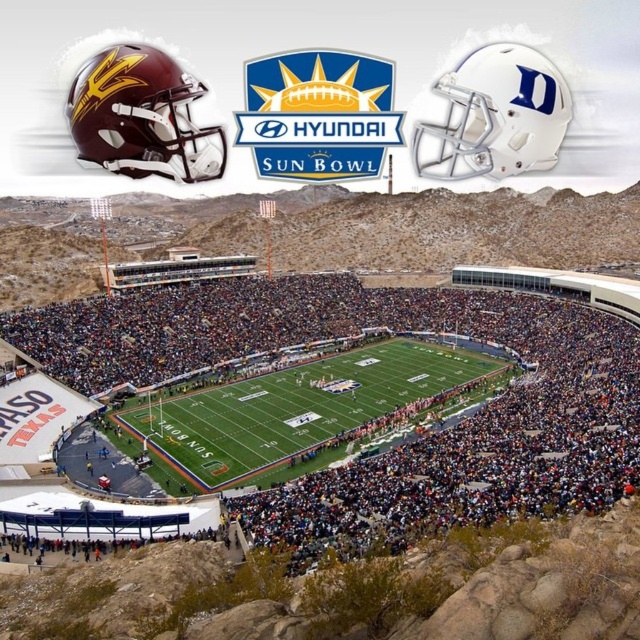
Is matte green turf at center thinner than maroon matte helmet at upper left?

Incorrect, matte green turf at center's width is not less than maroon matte helmet at upper left's.

Does point (205, 353) lie in front of point (150, 161)?

No, (205, 353) is further to viewer.

What do you see at coordinates (410, 442) in the screenshot? The width and height of the screenshot is (640, 640). I see `matte green turf at center` at bounding box center [410, 442].

Find the location of a particular element. The image size is (640, 640). matte green turf at center is located at coordinates (410, 442).

Does green turf football field at center appear over maroon matte helmet at upper left?

Incorrect, green turf football field at center is not positioned above maroon matte helmet at upper left.

Which is more to the right, green turf football field at center or maroon matte helmet at upper left?

Positioned to the right is green turf football field at center.

Which is behind, point (196, 474) or point (122, 51)?

The point (196, 474) is behind.

Find the location of `green turf football field at center`. green turf football field at center is located at coordinates (314, 410).

Is point (349, 524) more distant than point (234, 476)?

No, (349, 524) is closer to viewer.

Can you confirm if matte green turf at center is positioned below green turf football field at center?

Incorrect, matte green turf at center is not positioned below green turf football field at center.

Is point (381, 506) positioned before point (401, 422)?

Yes, it is in front of point (401, 422).

Where is `matte green turf at center`? Image resolution: width=640 pixels, height=640 pixels. matte green turf at center is located at coordinates (410, 442).